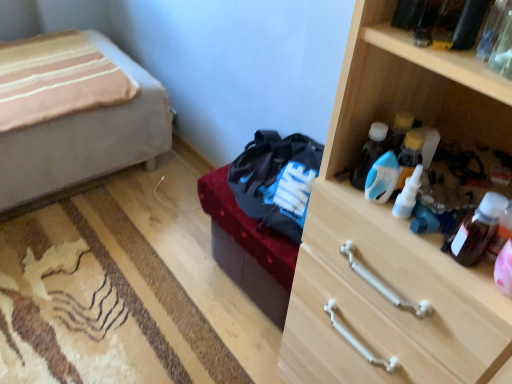
The width and height of the screenshot is (512, 384). What are the coordinates of `vacant region in front of dark brown leather bed frame at center` in the screenshot? It's located at (232, 344).